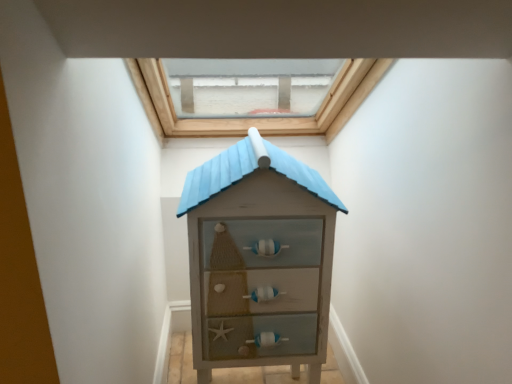
Question: Does wooden house-shaped chest of drawers at center come in front of transparent glass window at upper center?

Choices:
 (A) no
 (B) yes

Answer: (B)

Question: Is wooden house-shaped chest of drawers at center bigger than transparent glass window at upper center?

Choices:
 (A) no
 (B) yes

Answer: (A)

Question: Is wooden house-shaped chest of drawers at center facing towards transparent glass window at upper center?

Choices:
 (A) yes
 (B) no

Answer: (B)

Question: Is wooden house-shaped chest of drawers at center located outside transparent glass window at upper center?

Choices:
 (A) no
 (B) yes

Answer: (B)

Question: Is wooden house-shaped chest of drawers at center with transparent glass window at upper center?

Choices:
 (A) no
 (B) yes

Answer: (A)

Question: Does wooden house-shaped chest of drawers at center have a greater height compared to transparent glass window at upper center?

Choices:
 (A) yes
 (B) no

Answer: (A)

Question: Would you say transparent glass window at upper center contains wooden house-shaped chest of drawers at center?

Choices:
 (A) no
 (B) yes

Answer: (A)

Question: Are transparent glass window at upper center and wooden house-shaped chest of drawers at center far apart?

Choices:
 (A) no
 (B) yes

Answer: (A)

Question: Is transparent glass window at upper center at the left side of wooden house-shaped chest of drawers at center?

Choices:
 (A) yes
 (B) no

Answer: (A)

Question: Does transparent glass window at upper center lie in front of wooden house-shaped chest of drawers at center?

Choices:
 (A) no
 (B) yes

Answer: (A)

Question: From a real-world perspective, does transparent glass window at upper center sit lower than wooden house-shaped chest of drawers at center?

Choices:
 (A) no
 (B) yes

Answer: (A)

Question: Is transparent glass window at upper center looking in the opposite direction of wooden house-shaped chest of drawers at center?

Choices:
 (A) yes
 (B) no

Answer: (B)

Question: From a real-world perspective, is transparent glass window at upper center physically located above or below wooden house-shaped chest of drawers at center?

Choices:
 (A) above
 (B) below

Answer: (A)